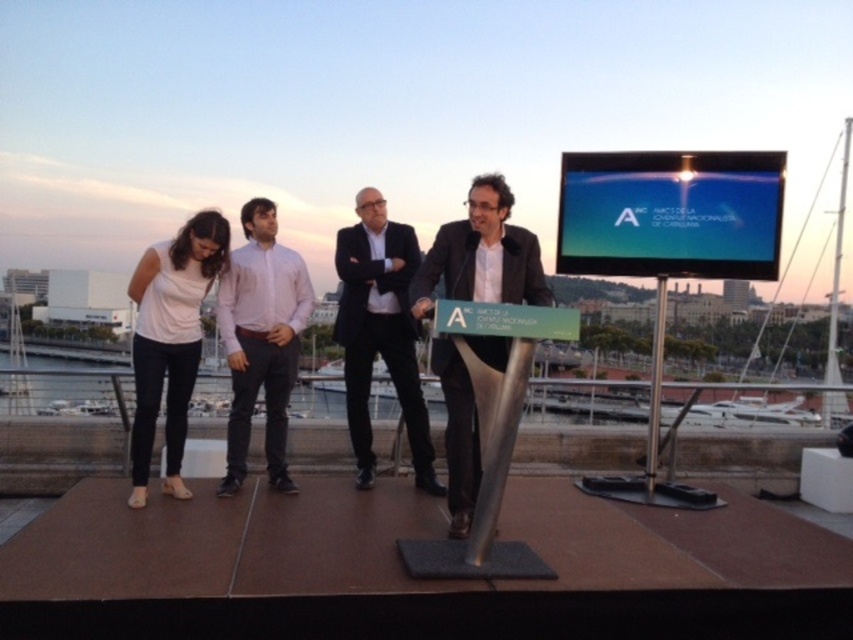
Looking at this image, can you confirm if black suit at center is shorter than dark gray suit at center?

Yes.

Between black suit at center and dark gray suit at center, which one is positioned lower?

black suit at center is lower down.

Which is in front, point (361, 417) or point (434, 246)?

Point (434, 246) is more forward.

Where is `black suit at center`? Image resolution: width=853 pixels, height=640 pixels. black suit at center is located at coordinates (380, 332).

Who is positioned more to the left, white matte shirt at left or dark gray suit at center?

Positioned to the left is white matte shirt at left.

Is white matte shirt at left taller than dark gray suit at center?

Yes, white matte shirt at left is taller than dark gray suit at center.

Locate an element on the screen. The width and height of the screenshot is (853, 640). white matte shirt at left is located at coordinates [x=170, y=339].

Can you confirm if pink cotton shirt at center is positioned to the left of dark gray suit at center?

Correct, you'll find pink cotton shirt at center to the left of dark gray suit at center.

Locate an element on the screen. pink cotton shirt at center is located at coordinates (260, 339).

Identify the location of pink cotton shirt at center. (260, 339).